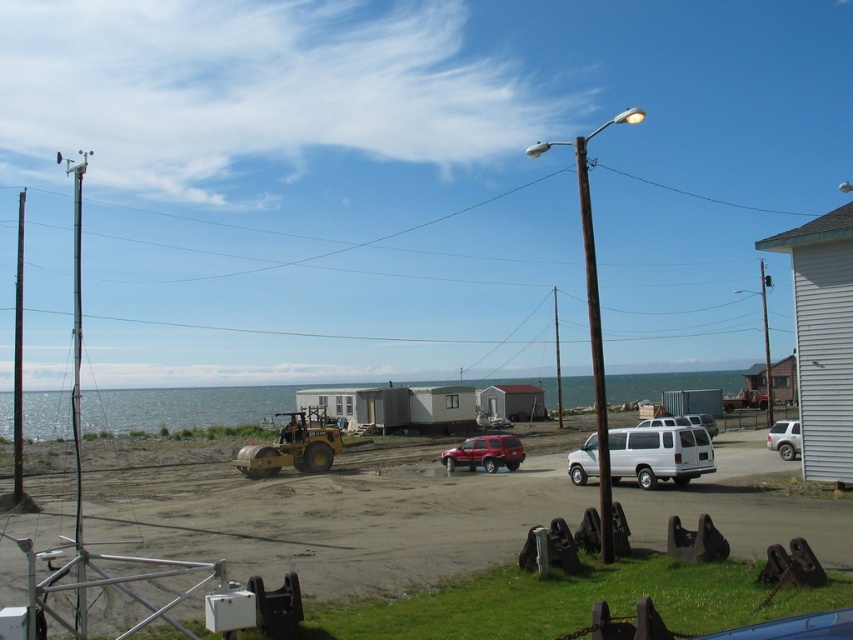
You are a delivery driver who needs to park your white matte car at right near the brown wooden pole at center. Considering the size difference between them, will your car fit in the space next to the pole?

The brown wooden pole at center is larger in size than the white matte car at right, so the car should fit in the space next to the pole since it is smaller in size.

You are a delivery person trying to determine if your 2.5 meters tall delivery drone can pass under the brown wooden pole at center without hitting the white matte car at right. Can it?

The brown wooden pole at center has a greater height compared to white matte car at right. Since the drone is 2.5 meters tall, it can safely pass under the pole as long as the pole is taller than 2.5 meters. However, the exact height of the pole isn not provided, so we can only confirm that it is taller than the car. If the car is shorter than 2.5 meters, the drone might hit it. Without specific measurements, we cannot definitively answer.